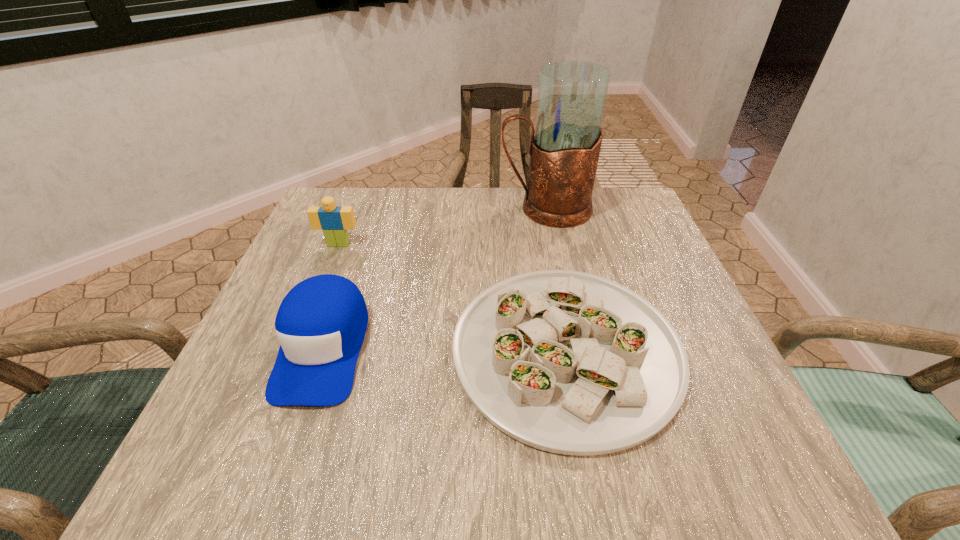
The width and height of the screenshot is (960, 540). I want to click on object that is positioned at the near right corner, so click(x=568, y=362).

Where is `vacant area at the far edge`? The width and height of the screenshot is (960, 540). vacant area at the far edge is located at coordinates (384, 216).

Where is `vacant position at the right edge of the desktop`? vacant position at the right edge of the desktop is located at coordinates (661, 284).

What are the coordinates of `free spot at the far left corner of the desktop` in the screenshot? It's located at (341, 188).

The width and height of the screenshot is (960, 540). Identify the location of vacant area at the far right corner. (610, 188).

Locate an element on the screen. The width and height of the screenshot is (960, 540). vacant position at the near right corner of the desktop is located at coordinates (767, 475).

Where is `free point between the third nearest object and the pitcher`? The width and height of the screenshot is (960, 540). free point between the third nearest object and the pitcher is located at coordinates (442, 226).

This screenshot has height=540, width=960. I want to click on free space between the platter and the second farthest object, so click(452, 297).

You are a GUI agent. You are given a task and a screenshot of the screen. Output one action in this format:
    pyautogui.click(x=<x>, y=<y>)
    Task: Click on the unoccupied position between the Lego and the pitcher
    Image resolution: width=960 pixels, height=540 pixels.
    Given the screenshot: What is the action you would take?
    pyautogui.click(x=442, y=226)

Identify the location of free space that is in between the third nearest object and the pitcher. This screenshot has width=960, height=540. (442, 226).